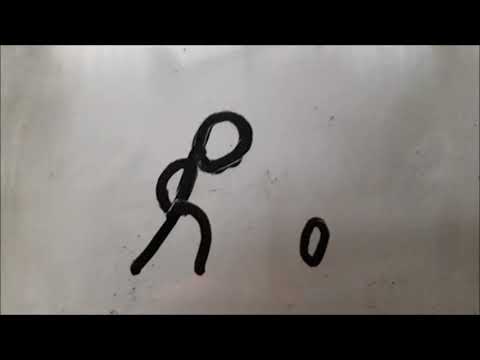
Locate an element on the screen. The image size is (480, 360). white wall is located at coordinates (403, 152).